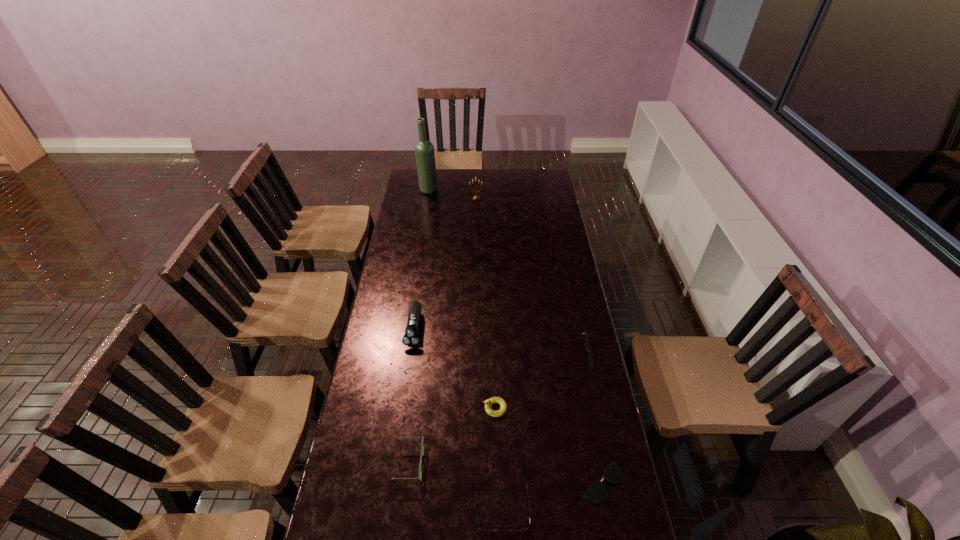
Find the location of `the shortest spectacles`. the shortest spectacles is located at coordinates (596, 493).

Where is `vacant space located 0.230m on the front of the tallest object`? This screenshot has height=540, width=960. vacant space located 0.230m on the front of the tallest object is located at coordinates (423, 219).

I want to click on free space located on the right of the candelabrum, so click(x=522, y=198).

Find the location of `free space located 0.170m on the head of the electric shaver`. free space located 0.170m on the head of the electric shaver is located at coordinates (406, 388).

Identify the location of blank space located 0.070m on the face of the duckling. (463, 408).

The image size is (960, 540). I want to click on free space located 0.100m on the face of the duckling, so click(453, 408).

Where is `free region located 0.270m on the face of the duckling`? The height and width of the screenshot is (540, 960). free region located 0.270m on the face of the duckling is located at coordinates pos(404,408).

Where is `vacant space located 0.310m on the lens of the leftmost spectacles`? vacant space located 0.310m on the lens of the leftmost spectacles is located at coordinates (523, 464).

This screenshot has width=960, height=540. I want to click on vacant space located 0.290m on the left of the shortest spectacles, so click(x=484, y=482).

Identify the location of object located in the far edge section of the desktop. The height and width of the screenshot is (540, 960). (424, 150).